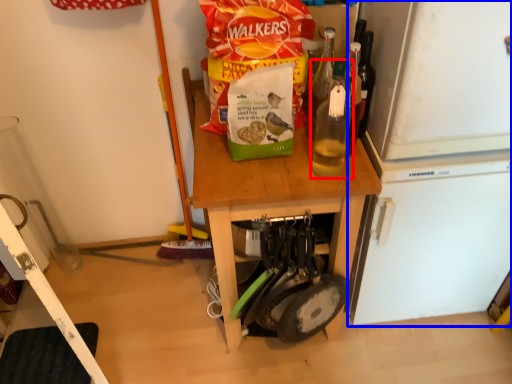
Question: Among these objects, which one is farthest to the camera, bottle (highlighted by a red box) or appliance (highlighted by a blue box)?

Choices:
 (A) bottle
 (B) appliance

Answer: (B)